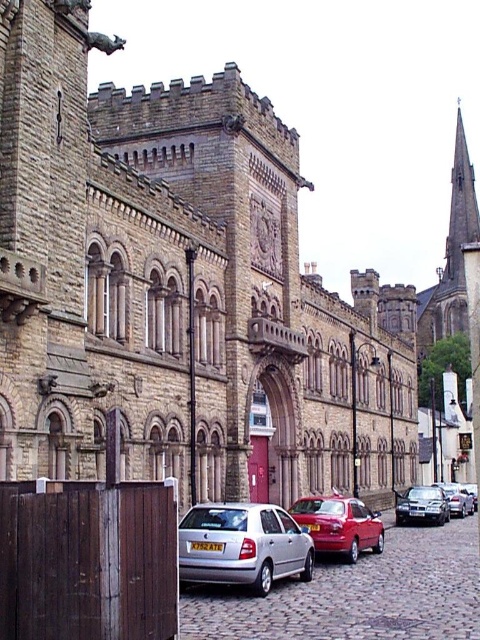
Question: Estimate the real-world distances between objects in this image. Which object is closer to the silver metallic hatchback at lower center?

Choices:
 (A) metallic silver car at center
 (B) shiny red car at center
 (C) silver metallic car at right

Answer: (B)

Question: Is shiny red car at center to the right of metallic silver car at center from the viewer's perspective?

Choices:
 (A) yes
 (B) no

Answer: (B)

Question: Is metallic silver car at center bigger than silver metallic car at right?

Choices:
 (A) no
 (B) yes

Answer: (A)

Question: Which is farther from the shiny red car at center?

Choices:
 (A) silver metallic hatchback at lower center
 (B) silver metallic car at right

Answer: (B)

Question: Which of the following is the farthest from the observer?

Choices:
 (A) (334, 513)
 (B) (255, 577)
 (C) (411, 496)
 (D) (460, 500)

Answer: (D)

Question: Can you confirm if silver metallic hatchback at lower center is bigger than metallic silver car at center?

Choices:
 (A) no
 (B) yes

Answer: (A)